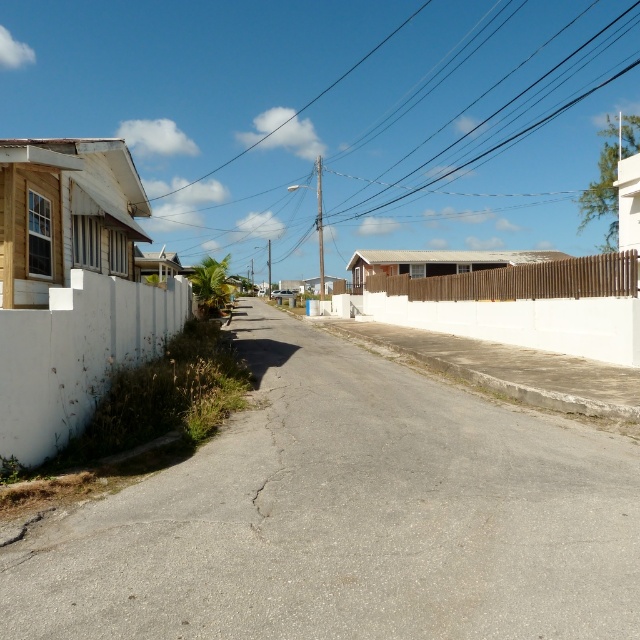
Between black wire at upper center and brown wooden fence at center, which one is positioned lower?

Positioned lower is brown wooden fence at center.

Does point (412, 200) come behind point (545, 288)?

Yes, it is behind point (545, 288).

The image size is (640, 640). I want to click on black wire at upper center, so pos(368,124).

Which is more to the right, black wire at upper center or white wooden fence at center?

white wooden fence at center

Can you confirm if black wire at upper center is shorter than white wooden fence at center?

Incorrect, black wire at upper center's height does not fall short of white wooden fence at center's.

Is point (397, 225) in front of point (481, 316)?

No, it is not.

I want to click on black wire at upper center, so click(x=368, y=124).

Is white wooden fence at center thinner than brown wooden fence at center?

Yes, white wooden fence at center is thinner than brown wooden fence at center.

Is white wooden fence at center positioned at the back of brown wooden fence at center?

No.

Does point (404, 280) come behind point (628, 259)?

That is True.

Find the location of a particular element. The height and width of the screenshot is (640, 640). white wooden fence at center is located at coordinates (524, 305).